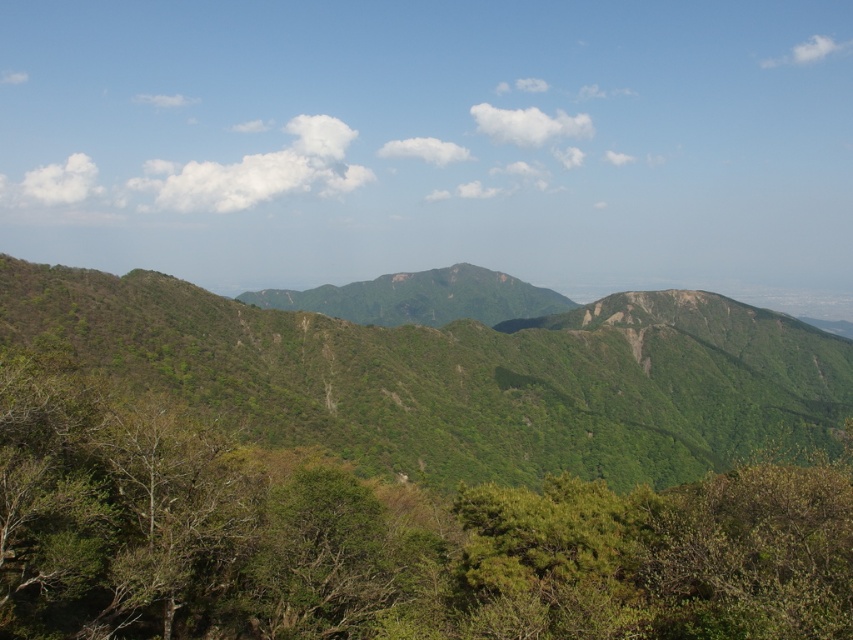
You are a hiker planning to take a photo of the green leafy tree at center and the green rocky mountain at center. From your current position, which object will appear closer in the photo?

The green leafy tree at center will appear closer in the photo because it is positioned in front of the green rocky mountain at center.

You are a hiker planning to take a photo of the mountain landscape. You have two points marked on your map at coordinates point (577, 496) and point (399, 298). Which point should you choose to stand at to get a closer view of the foreground trees?

You should stand at point (577, 496) because it is closer to the camera, providing a better vantage point to capture the foreground trees in detail.